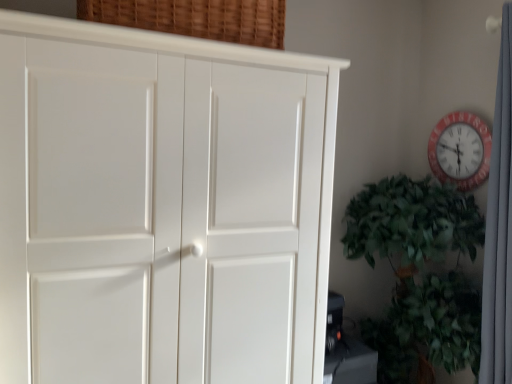
Question: Is white fabric curtain at right bigger than red plastic wall clock at upper right?

Choices:
 (A) yes
 (B) no

Answer: (A)

Question: From a real-world perspective, is white fabric curtain at right beneath red plastic wall clock at upper right?

Choices:
 (A) yes
 (B) no

Answer: (A)

Question: From the image's perspective, does white fabric curtain at right appear lower than red plastic wall clock at upper right?

Choices:
 (A) no
 (B) yes

Answer: (B)

Question: Is the surface of white fabric curtain at right in direct contact with red plastic wall clock at upper right?

Choices:
 (A) no
 (B) yes

Answer: (A)

Question: Is the position of white fabric curtain at right less distant than that of red plastic wall clock at upper right?

Choices:
 (A) no
 (B) yes

Answer: (B)

Question: From their relative heights in the image, would you say red plastic wall clock at upper right is taller or shorter than white matte cupboard at left?

Choices:
 (A) short
 (B) tall

Answer: (A)

Question: Is point (441, 177) positioned closer to the camera than point (283, 104)?

Choices:
 (A) farther
 (B) closer

Answer: (A)

Question: Is red plastic wall clock at upper right wider or thinner than white matte cupboard at left?

Choices:
 (A) thin
 (B) wide

Answer: (A)

Question: From a real-world perspective, is red plastic wall clock at upper right positioned above or below white matte cupboard at left?

Choices:
 (A) below
 (B) above

Answer: (B)

Question: Is white matte cupboard at left wider or thinner than white fabric curtain at right?

Choices:
 (A) thin
 (B) wide

Answer: (B)

Question: Considering the relative positions of white matte cupboard at left and white fabric curtain at right in the image provided, is white matte cupboard at left to the left or to the right of white fabric curtain at right?

Choices:
 (A) left
 (B) right

Answer: (A)

Question: Considering their positions, is white matte cupboard at left located in front of or behind white fabric curtain at right?

Choices:
 (A) front
 (B) behind

Answer: (A)

Question: From a real-world perspective, is white matte cupboard at left above or below white fabric curtain at right?

Choices:
 (A) below
 (B) above

Answer: (A)

Question: From a real-world perspective, relative to white fabric curtain at right, is red plastic wall clock at upper right vertically above or below?

Choices:
 (A) below
 (B) above

Answer: (B)

Question: Is red plastic wall clock at upper right wider or thinner than white fabric curtain at right?

Choices:
 (A) thin
 (B) wide

Answer: (A)